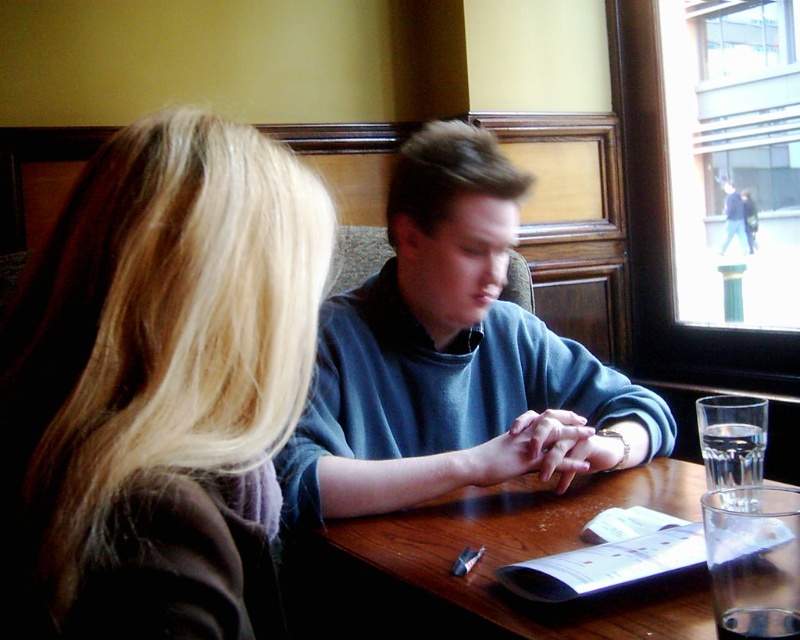
You are a photographer taking a picture of the blue cotton shirt at center and the wooden table at center. Which object will appear larger in the photo?

The blue cotton shirt at center will appear larger in the photo because it is closer to the viewer than the wooden table at center.

You are a delivery person who needs to place a new menu between the blonde hair at upper left and the blue matte sweater at center at a specific distance. The required distance between them should be 24 inches. Based on the current distance, is the space between them sufficient?

The current distance between the blonde hair at upper left and the blue matte sweater at center is 22.57 inches, which is less than the required 24 inches. Therefore, the space between them is not sufficient.

You are a tailor measuring the blue cotton shirt at center and the wooden table at center for a custom tablecloth. Which object has a greater width?

The blue cotton shirt at center has a greater width than the wooden table at center according to the description.